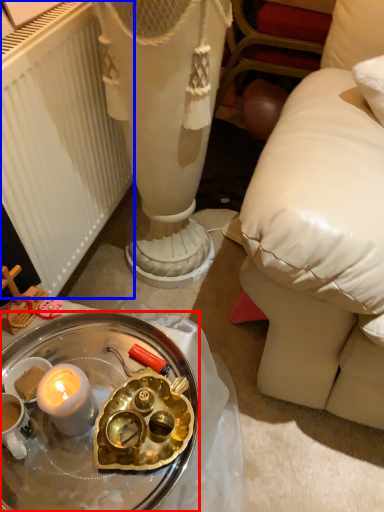
Question: Which point is further to the camera, desk (highlighted by a red box) or radiator (highlighted by a blue box)?

Choices:
 (A) desk
 (B) radiator

Answer: (B)